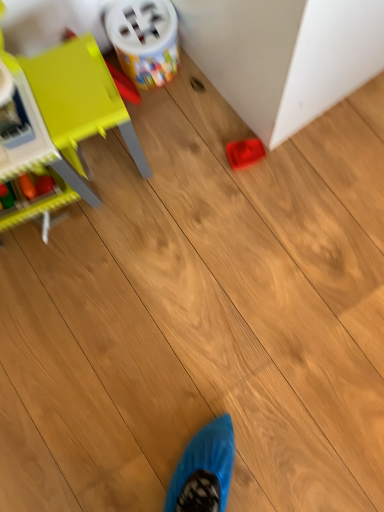
Question: Is plastic container at upper center, acting as the second toy starting from the left, wider or thinner than matte yellow chair at left, which is the 3th toy in right-to-left order?

Choices:
 (A) thin
 (B) wide

Answer: (A)

Question: Would you say plastic container at upper center, acting as the second toy starting from the left, is inside or outside matte yellow chair at left, which is the 3th toy in right-to-left order?

Choices:
 (A) inside
 (B) outside

Answer: (B)

Question: Considering the real-world distances, which object is closest to the rubberized red tray at lower right?

Choices:
 (A) matte yellow chair at left, which is the 3th toy in right-to-left order
 (B) plastic container at upper center, acting as the second toy starting from the left
 (C) matte plastic tray at center-right, arranged as the first toy when viewed from the right

Answer: (C)

Question: Which is farther from the matte yellow chair at left, the 1th toy in the left-to-right sequence?

Choices:
 (A) rubberized red tray at lower right
 (B) plastic container at upper center, acting as the second toy starting from the left
 (C) matte plastic tray at center-right, the 3th toy when ordered from left to right

Answer: (A)